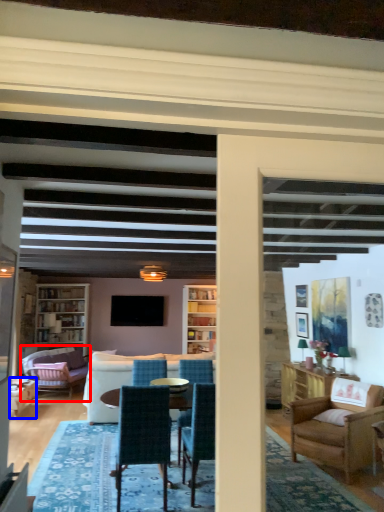
Question: Which object appears farthest to the camera in this image, studio couch (highlighted by a red box) or chair (highlighted by a blue box)?

Choices:
 (A) studio couch
 (B) chair

Answer: (A)